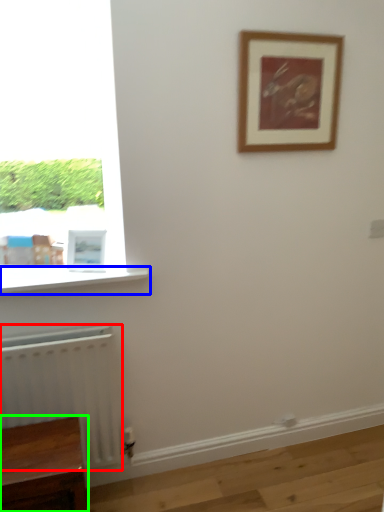
Question: Which is nearer to the radiator (highlighted by a red box)? window sill (highlighted by a blue box) or furniture (highlighted by a green box).

Choices:
 (A) window sill
 (B) furniture

Answer: (B)